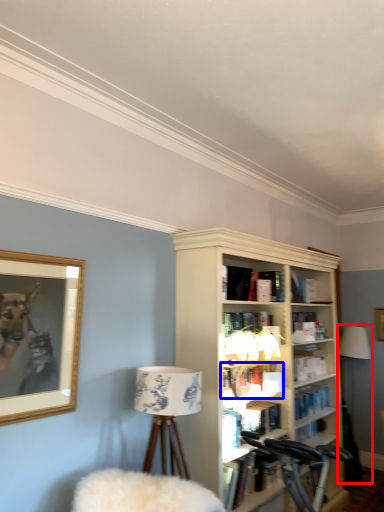
Question: Which object appears farthest to the camera in this image, table lamp (highlighted by a red box) or book (highlighted by a blue box)?

Choices:
 (A) table lamp
 (B) book

Answer: (A)